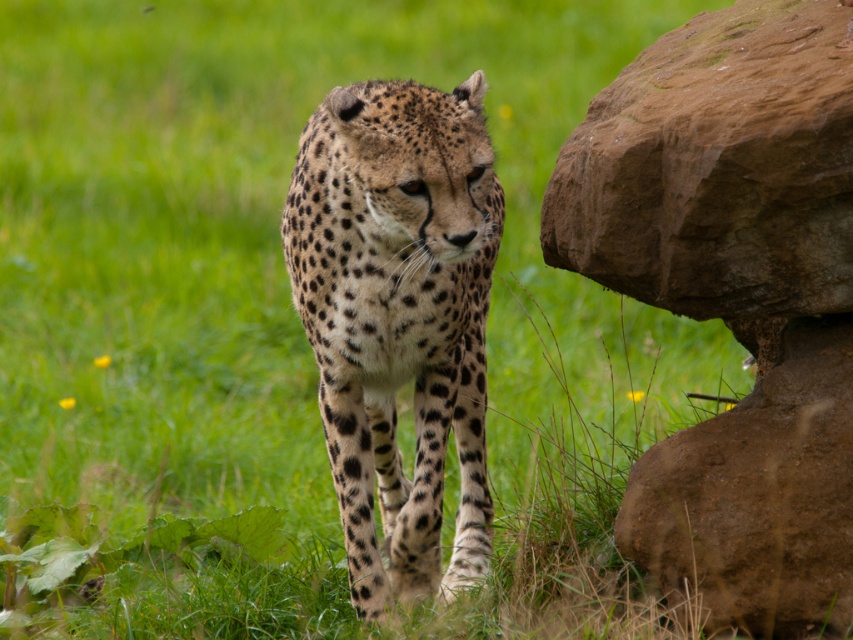
Is spotted fur cheetah at center further to camera compared to brown rough rock at right?

No, spotted fur cheetah at center is closer to the viewer.

Does spotted fur cheetah at center have a lesser width compared to brown rough rock at right?

Yes, spotted fur cheetah at center is thinner than brown rough rock at right.

Between point (350, 356) and point (608, 131), which one is positioned behind?

The point (608, 131) is behind.

I want to click on spotted fur cheetah at center, so click(398, 320).